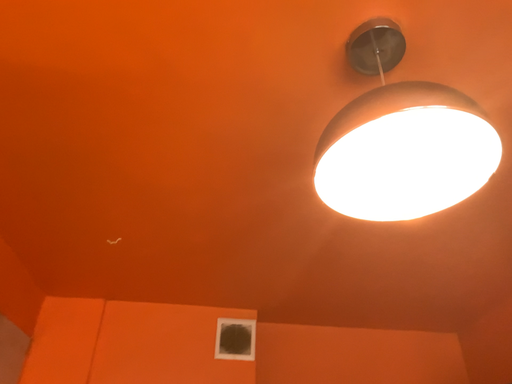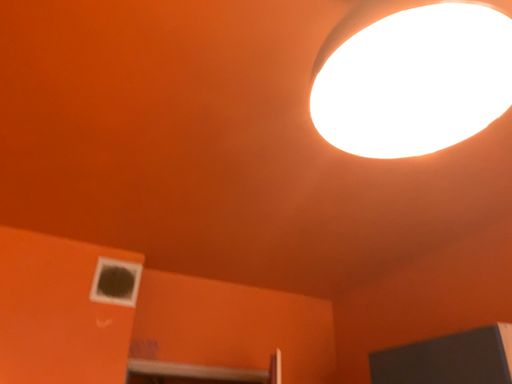
Question: How did the camera likely rotate when shooting the video?

Choices:
 (A) rotated left
 (B) rotated right

Answer: (B)